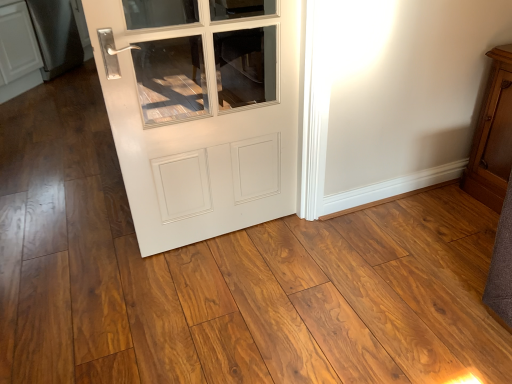
Question: From a real-world perspective, is white glossy door at center above or below wooden cabinet at right?

Choices:
 (A) above
 (B) below

Answer: (A)

Question: In the image, is white glossy door at center on the left side or the right side of wooden cabinet at right?

Choices:
 (A) right
 (B) left

Answer: (B)

Question: Estimate the real-world distances between objects in this image. Which object is farther from the satin black refrigerator at left?

Choices:
 (A) wooden cabinet at right
 (B) white glossy door at center

Answer: (A)

Question: Which object is the closest to the wooden cabinet at right?

Choices:
 (A) satin black refrigerator at left
 (B) white glossy door at center

Answer: (B)